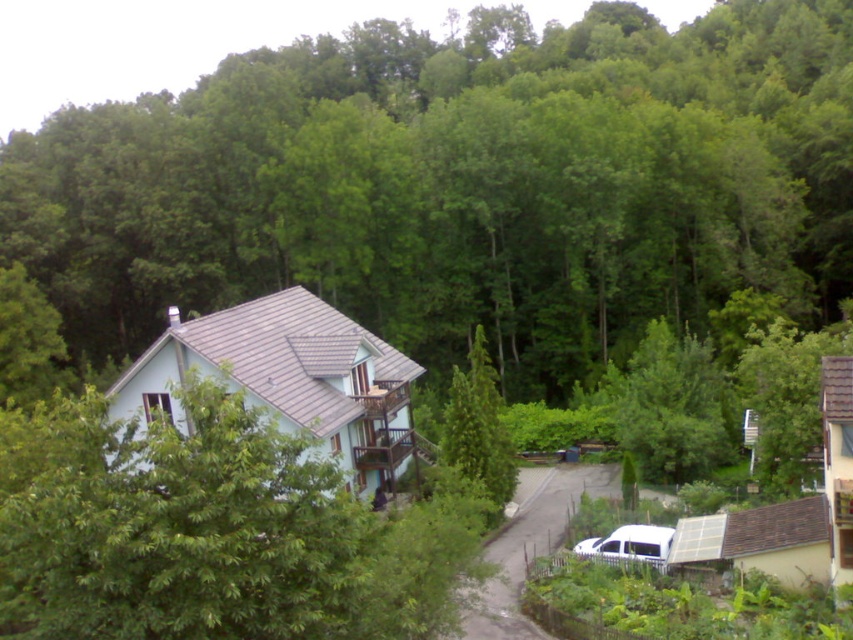
You are a delivery person approaching the house and need to park your vehicle. The white matte van at lower right is already parked near the structure. Is the green leafy tree at center blocking the path to the house?

The green leafy tree at center is above the white matte van at lower right, so it is positioned higher up and not directly in front of the van. This means the tree is likely not blocking the path to the house since it is above the van, which is parked lower down.

You are a delivery person trying to reach the light blue house. You see the green leafy tree at center and the white matte van at lower right. Which object is closer to your current position?

The white matte van at lower right is closer to your current position because it is only 81.88 meters away from the green leafy tree at center, but without knowing the exact distance from your position, we can infer that the van is near the road leading to the house, making it closer than the tree which is part of the dense greenery backdrop.

You are a delivery person trying to navigate to the light blue house. You see the green leafy tree at center and the green textured tree at center. Which tree should you avoid to stay on the road leading to the house?

The green leafy tree at center has a larger size compared to green textured tree at center, so you should avoid the green leafy tree at center to stay on the road leading to the house.